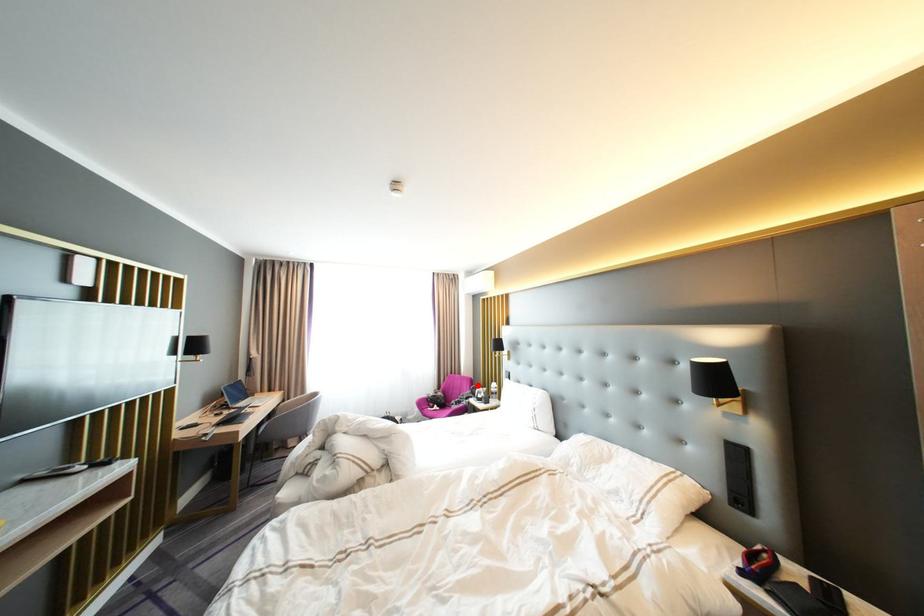
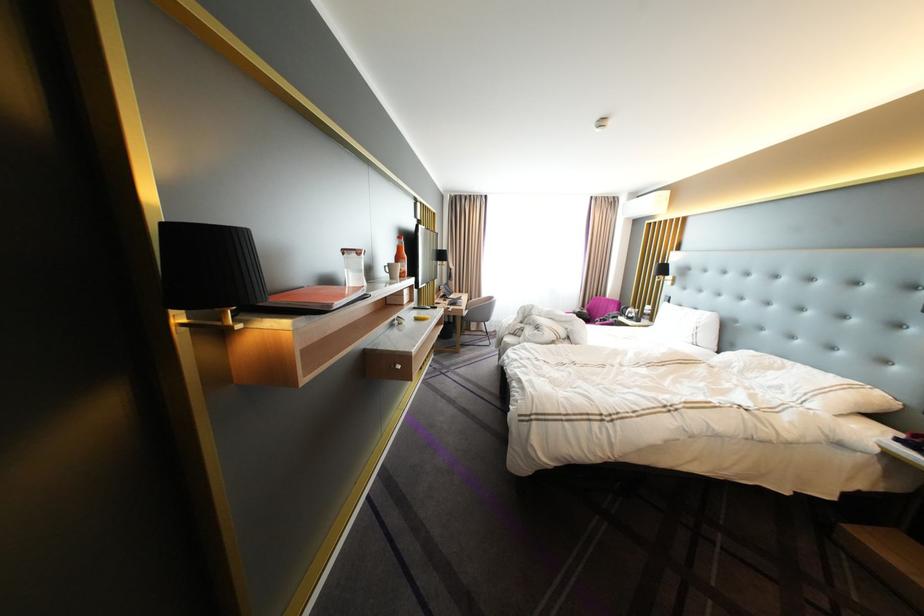
Question: I am providing you with two images of the same scene from different viewpoints. Image1 has a red point marked. In image2, the corresponding 3D location appears at what relative position? Reply with the corresponding letter.

Choices:
 (A) Closer
 (B) Farther

Answer: (A)